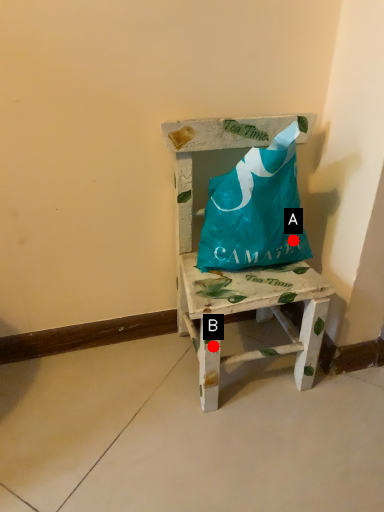
Question: Two points are circled on the image, labeled by A and B beside each circle. Among these points, which one is farthest from the camera?

Choices:
 (A) A is further
 (B) B is further

Answer: (A)